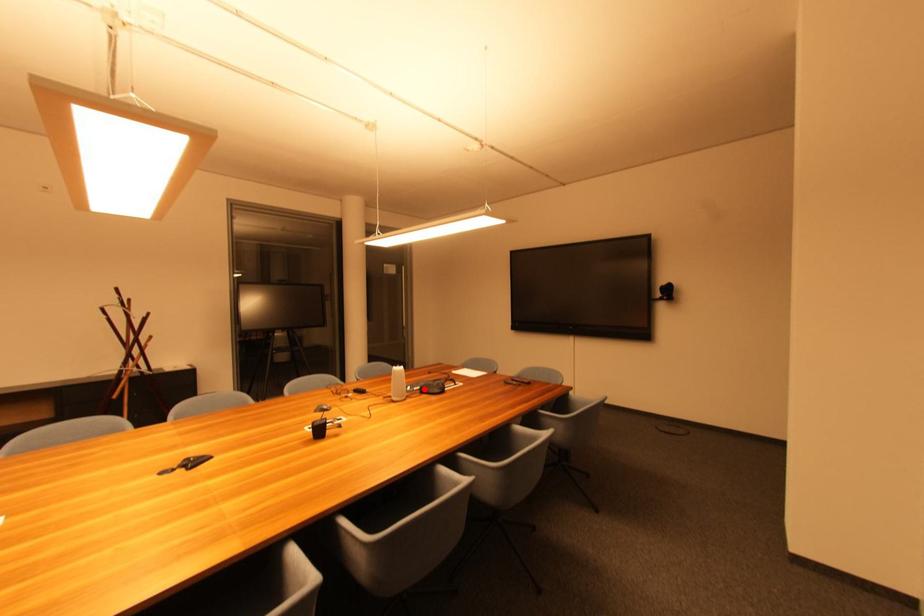
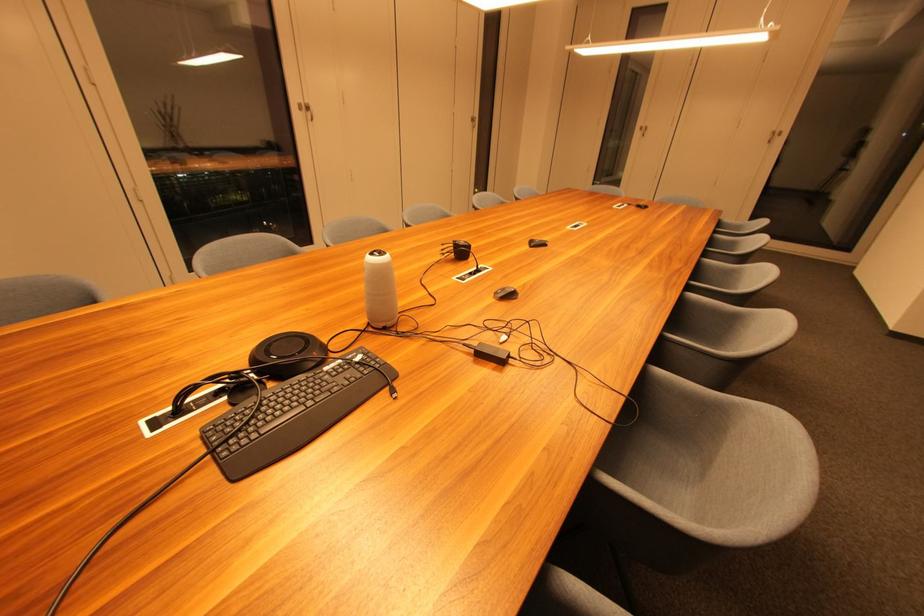
In the second image, find the point that corresponds to the highlighted location in the first image.

(332, 371)